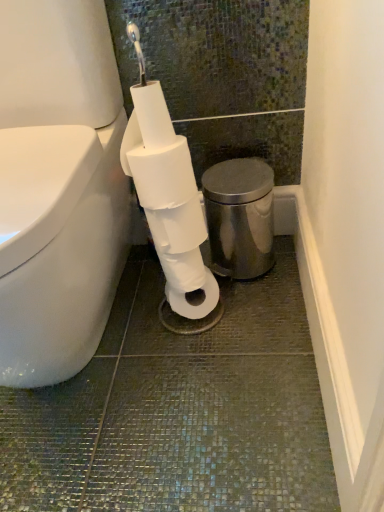
This screenshot has height=512, width=384. Describe the element at coordinates (240, 217) in the screenshot. I see `polished stainless steel bidet at right` at that location.

Image resolution: width=384 pixels, height=512 pixels. What are the coordinates of `polished stainless steel bidet at right` in the screenshot? It's located at (240, 217).

In terms of size, does polished stainless steel bidet at right appear bigger or smaller than white matte toilet paper at center, the 2th toilet paper in the bottom-to-top sequence?

Clearly, polished stainless steel bidet at right is larger in size than white matte toilet paper at center, the 2th toilet paper in the bottom-to-top sequence.

From the image's perspective, is polished stainless steel bidet at right above or below white matte toilet paper at center, the 2th toilet paper in the bottom-to-top sequence?

polished stainless steel bidet at right is below white matte toilet paper at center, the 2th toilet paper in the bottom-to-top sequence.

Is polished stainless steel bidet at right next to white matte toilet paper at center, the 2th toilet paper in the bottom-to-top sequence?

There is a gap between polished stainless steel bidet at right and white matte toilet paper at center, the 2th toilet paper in the bottom-to-top sequence.

Considering the positions of points (251, 195) and (158, 195), is point (251, 195) closer to camera compared to point (158, 195)?

No, (251, 195) is behind (158, 195).

From a real-world perspective, is polished stainless steel bidet at right beneath white matte toilet paper at center, which is counted as the second toilet paper, starting from the top?

Yes, from a real-world perspective, polished stainless steel bidet at right is below white matte toilet paper at center, which is counted as the second toilet paper, starting from the top.

Is polished stainless steel bidet at right closer to the viewer compared to white matte toilet paper at center, the first toilet paper in the bottom-to-top sequence?

No, polished stainless steel bidet at right is further to the viewer.

From the image's perspective, which one is positioned lower, polished stainless steel bidet at right or white matte toilet paper at center, which is counted as the second toilet paper, starting from the top?

white matte toilet paper at center, which is counted as the second toilet paper, starting from the top, is shown below in the image.

From a real-world perspective, is white matte toilet paper at center, positioned as the 1th toilet paper in top-to-bottom order, physically located above or below white matte toilet paper at center, which is counted as the second toilet paper, starting from the top?

In terms of real-world spatial position, white matte toilet paper at center, positioned as the 1th toilet paper in top-to-bottom order, is above white matte toilet paper at center, which is counted as the second toilet paper, starting from the top.

Does white matte toilet paper at center, the 2th toilet paper in the bottom-to-top sequence, turn towards white matte toilet paper at center, which is counted as the second toilet paper, starting from the top?

No, white matte toilet paper at center, the 2th toilet paper in the bottom-to-top sequence, does not turn towards white matte toilet paper at center, which is counted as the second toilet paper, starting from the top.

Is white matte toilet paper at center, positioned as the 1th toilet paper in top-to-bottom order, bigger than white matte toilet paper at center, the first toilet paper in the bottom-to-top sequence?

Yes, white matte toilet paper at center, positioned as the 1th toilet paper in top-to-bottom order, is bigger than white matte toilet paper at center, the first toilet paper in the bottom-to-top sequence.

From the image's perspective, does white matte toilet paper at center, positioned as the 1th toilet paper in top-to-bottom order, appear higher than white matte toilet paper at center, the first toilet paper in the bottom-to-top sequence?

Indeed, from the image's perspective, white matte toilet paper at center, positioned as the 1th toilet paper in top-to-bottom order, is shown above white matte toilet paper at center, the first toilet paper in the bottom-to-top sequence.

Choose the correct answer: Is white matte toilet paper at center, the first toilet paper in the bottom-to-top sequence, inside white matte toilet paper at center, positioned as the 1th toilet paper in top-to-bottom order, or outside it?

white matte toilet paper at center, the first toilet paper in the bottom-to-top sequence, lies outside white matte toilet paper at center, positioned as the 1th toilet paper in top-to-bottom order.

Is white matte toilet paper at center, the first toilet paper in the bottom-to-top sequence, in front of or behind white matte toilet paper at center, the 2th toilet paper in the bottom-to-top sequence, in the image?

Clearly, white matte toilet paper at center, the first toilet paper in the bottom-to-top sequence, is behind white matte toilet paper at center, the 2th toilet paper in the bottom-to-top sequence.

From the image's perspective, which is below, white matte toilet paper at center, which is counted as the second toilet paper, starting from the top, or white matte toilet paper at center, positioned as the 1th toilet paper in top-to-bottom order?

white matte toilet paper at center, which is counted as the second toilet paper, starting from the top, is shown below in the image.

Is white matte toilet paper at center, the first toilet paper in the bottom-to-top sequence, looking in the opposite direction of polished stainless steel bidet at right?

No, white matte toilet paper at center, the first toilet paper in the bottom-to-top sequence,'s orientation is not away from polished stainless steel bidet at right.

Considering the relative positions of white matte toilet paper at center, the first toilet paper in the bottom-to-top sequence, and polished stainless steel bidet at right in the image provided, is white matte toilet paper at center, the first toilet paper in the bottom-to-top sequence, to the left of polished stainless steel bidet at right from the viewer's perspective?

Yes, white matte toilet paper at center, the first toilet paper in the bottom-to-top sequence, is to the left of polished stainless steel bidet at right.

Between point (192, 250) and point (251, 202), which one is positioned in front?

The point (192, 250) is closer.

Is white matte toilet paper at center, which is counted as the second toilet paper, starting from the top, bigger or smaller than polished stainless steel bidet at right?

In the image, white matte toilet paper at center, which is counted as the second toilet paper, starting from the top, appears to be smaller than polished stainless steel bidet at right.

Could you measure the distance between white matte toilet paper at center, the 2th toilet paper in the bottom-to-top sequence, and polished stainless steel bidet at right?

A distance of 24.73 centimeters exists between white matte toilet paper at center, the 2th toilet paper in the bottom-to-top sequence, and polished stainless steel bidet at right.

Who is taller, white matte toilet paper at center, positioned as the 1th toilet paper in top-to-bottom order, or polished stainless steel bidet at right?

Standing taller between the two is polished stainless steel bidet at right.

Is white matte toilet paper at center, positioned as the 1th toilet paper in top-to-bottom order, to the right of polished stainless steel bidet at right from the viewer's perspective?

In fact, white matte toilet paper at center, positioned as the 1th toilet paper in top-to-bottom order, is to the left of polished stainless steel bidet at right.

Is white matte toilet paper at center, positioned as the 1th toilet paper in top-to-bottom order, oriented away from polished stainless steel bidet at right?

No, white matte toilet paper at center, positioned as the 1th toilet paper in top-to-bottom order,'s orientation is not away from polished stainless steel bidet at right.

Where is `toilet paper above the polished stainless steel bidet at right (from the image's perspective)`? toilet paper above the polished stainless steel bidet at right (from the image's perspective) is located at coordinates (163, 174).

Where is `toilet paper that is the 1st object located in front of the polished stainless steel bidet at right`? The height and width of the screenshot is (512, 384). toilet paper that is the 1st object located in front of the polished stainless steel bidet at right is located at coordinates (183, 270).

Which object lies further to the anchor point polished stainless steel bidet at right, white matte toilet paper at center, positioned as the 1th toilet paper in top-to-bottom order, or white matte toilet paper at center, which is counted as the second toilet paper, starting from the top?

The object further to polished stainless steel bidet at right is white matte toilet paper at center, positioned as the 1th toilet paper in top-to-bottom order.

From the image, which object appears to be farther from white matte toilet paper at center, the 2th toilet paper in the bottom-to-top sequence, polished stainless steel bidet at right or white matte toilet paper at center, the first toilet paper in the bottom-to-top sequence?

Based on the image, polished stainless steel bidet at right appears to be further to white matte toilet paper at center, the 2th toilet paper in the bottom-to-top sequence.

Estimate the real-world distances between objects in this image. Which object is closer to white matte toilet paper at center, positioned as the 1th toilet paper in top-to-bottom order, white matte toilet paper at center, the first toilet paper in the bottom-to-top sequence, or polished stainless steel bidet at right?

white matte toilet paper at center, the first toilet paper in the bottom-to-top sequence, is closer to white matte toilet paper at center, positioned as the 1th toilet paper in top-to-bottom order.

Which object lies nearer to the anchor point white matte toilet paper at center, which is counted as the second toilet paper, starting from the top, polished stainless steel bidet at right or white matte toilet paper at center, the 2th toilet paper in the bottom-to-top sequence?

white matte toilet paper at center, the 2th toilet paper in the bottom-to-top sequence.

Estimate the real-world distances between objects in this image. Which object is further from white matte toilet paper at center, the first toilet paper in the bottom-to-top sequence, white matte toilet paper at center, the 2th toilet paper in the bottom-to-top sequence, or polished stainless steel bidet at right?

polished stainless steel bidet at right is further to white matte toilet paper at center, the first toilet paper in the bottom-to-top sequence.

Looking at the image, which one is located closer to polished stainless steel bidet at right, white matte toilet paper at center, which is counted as the second toilet paper, starting from the top, or white matte toilet paper at center, positioned as the 1th toilet paper in top-to-bottom order?

Based on the image, white matte toilet paper at center, which is counted as the second toilet paper, starting from the top, appears to be nearer to polished stainless steel bidet at right.

The width and height of the screenshot is (384, 512). Find the location of `toilet paper situated between white matte toilet paper at center, positioned as the 1th toilet paper in top-to-bottom order, and polished stainless steel bidet at right from left to right`. toilet paper situated between white matte toilet paper at center, positioned as the 1th toilet paper in top-to-bottom order, and polished stainless steel bidet at right from left to right is located at coordinates (183, 270).